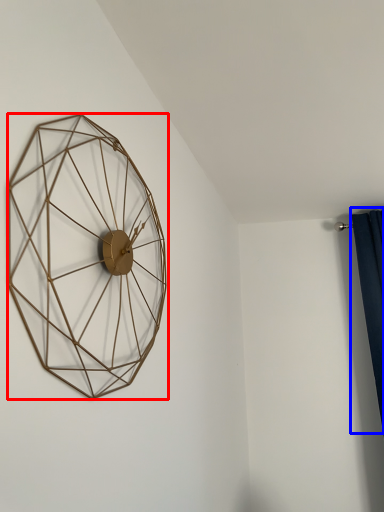
Question: Which point is closer to the camera, wall clock (highlighted by a red box) or curtain (highlighted by a blue box)?

Choices:
 (A) wall clock
 (B) curtain

Answer: (A)